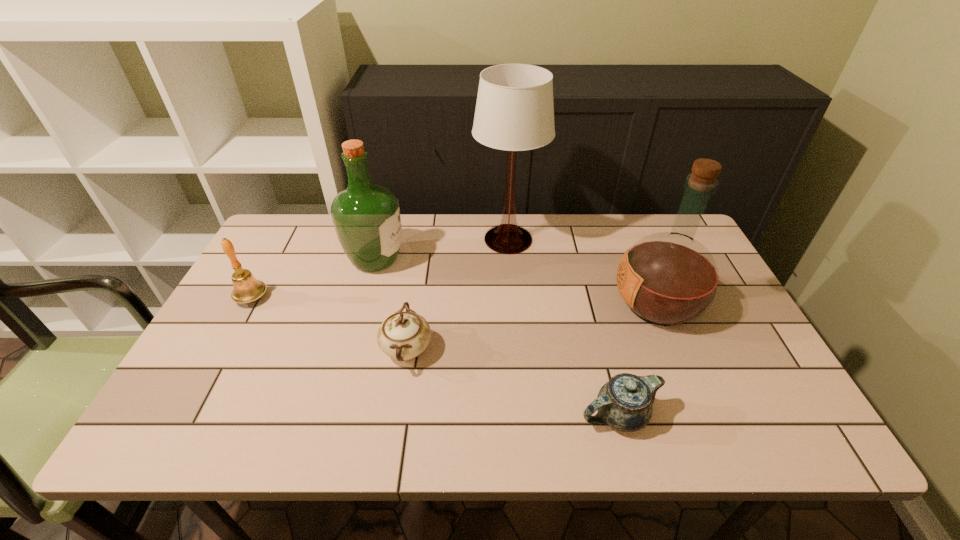
Image resolution: width=960 pixels, height=540 pixels. I want to click on empty space between the left chinaware and the left liquor, so click(x=391, y=305).

Identify the location of free space that is in between the farther chinaware and the right liquor. This screenshot has width=960, height=540. (532, 327).

The width and height of the screenshot is (960, 540). What are the coordinates of `object that stands as the fourth closest to the fourth object from left to right` in the screenshot? It's located at (625, 402).

Select which object is the closest to the third object from right to left. Please provide its 2D coordinates. Your answer should be formatted as a tuple, i.e. [(x, y)], where the tuple contains the x and y coordinates of a point satisfying the conditions above.

[(668, 279)]

Locate an element on the screen. Image resolution: width=960 pixels, height=540 pixels. free spot that satisfies the following two spatial constraints: 1. on the front-facing side of the left liquor; 2. on the left side of the left chinaware is located at coordinates (350, 349).